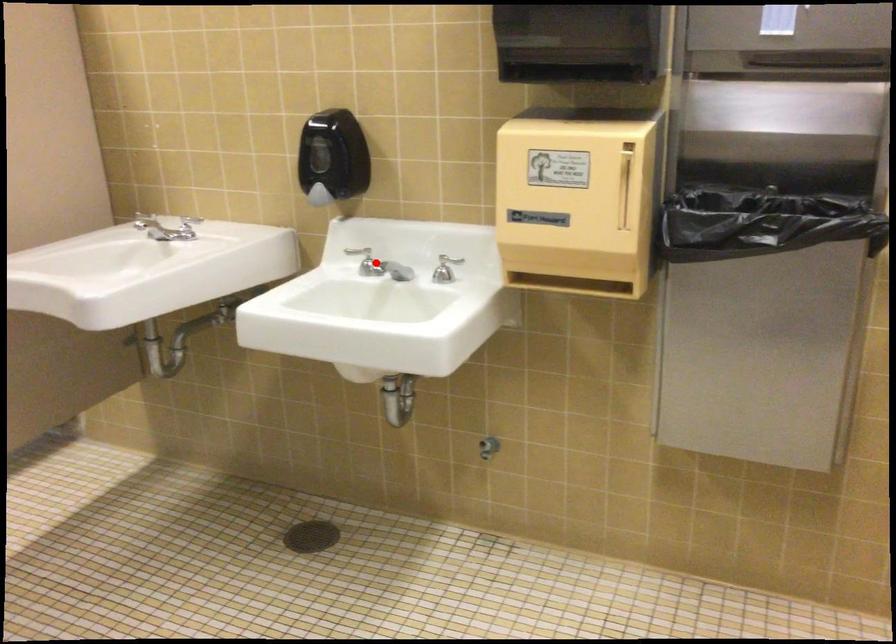
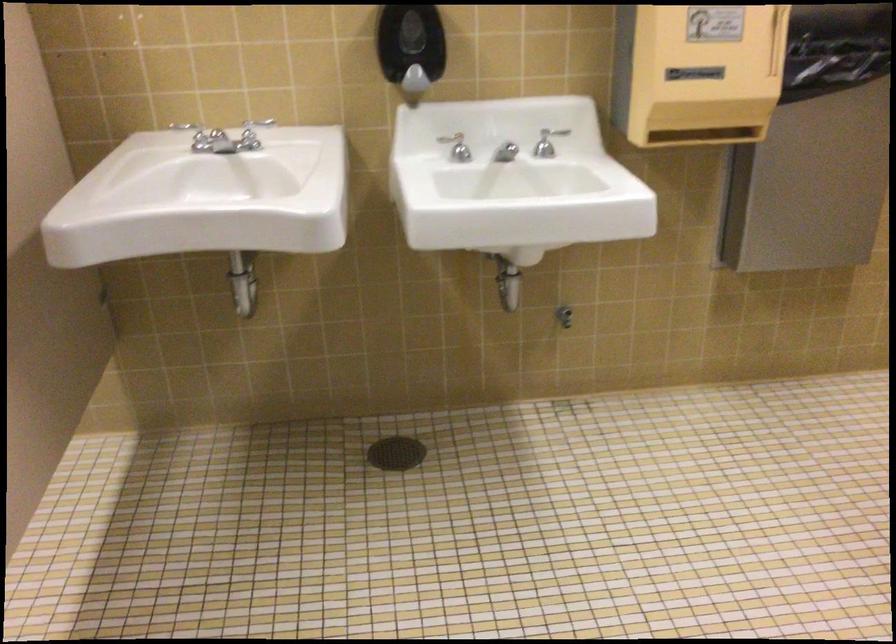
Where in the second image is the point corresponding to the highlighted location from the first image?

(457, 147)